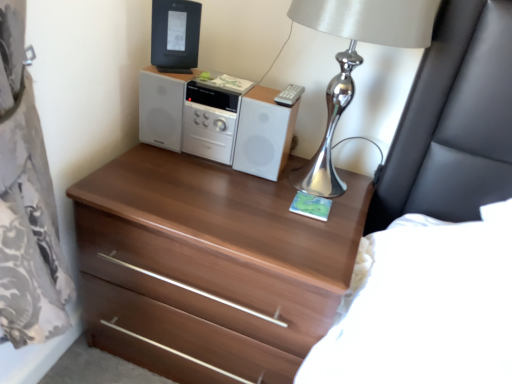
You are a GUI agent. You are given a task and a screenshot of the screen. Output one action in this format:
    pyautogui.click(x=<x>, y=<y>)
    Task: Click on the free region on the left part of silver metallic table lamp at upper right
    The width and height of the screenshot is (512, 384).
    Given the screenshot: What is the action you would take?
    pyautogui.click(x=194, y=194)